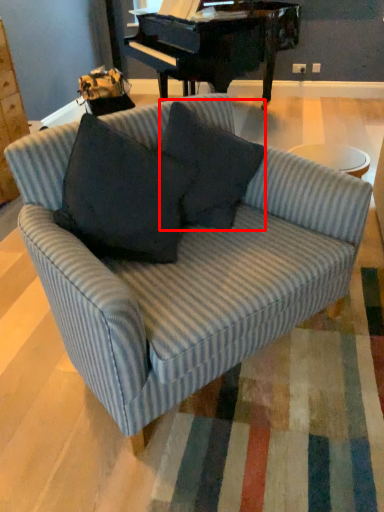
Question: Considering the relative positions of throw pillow (annotated by the red box) and studio couch in the image provided, where is throw pillow (annotated by the red box) located with respect to the staircase?

Choices:
 (A) left
 (B) right

Answer: (B)